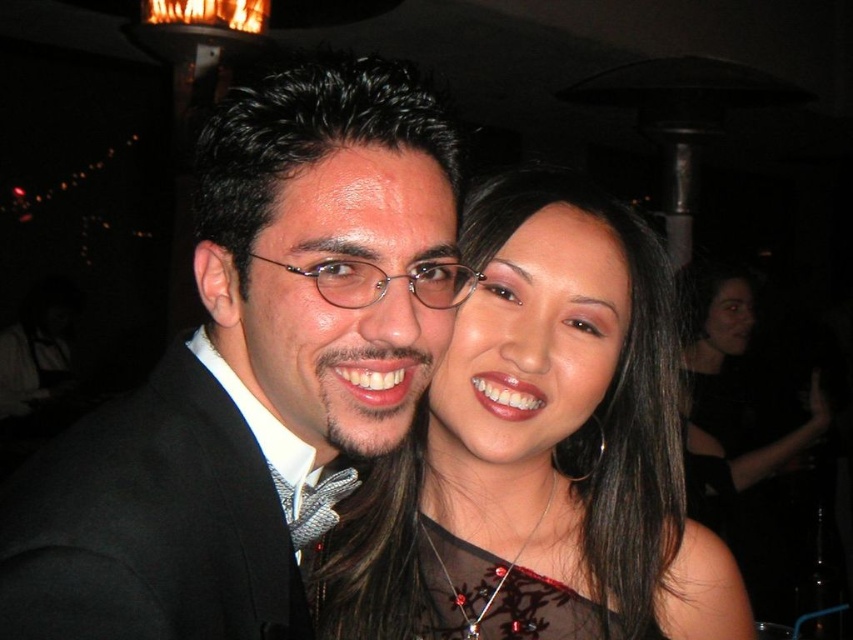
In the scene shown: Can you confirm if black wool suit at left is shorter than black satin dress at right?

Indeed, black wool suit at left has a lesser height compared to black satin dress at right.

Measure the distance from black wool suit at left to black satin dress at right.

black wool suit at left is 7.36 feet from black satin dress at right.

Between point (234, 536) and point (780, 592), which one is positioned in front?

Point (234, 536)

What are the coordinates of `black wool suit at left` in the screenshot? It's located at (152, 520).

Which is above, satin black dress at center or black satin dress at right?

satin black dress at center is higher up.

Which is more to the right, satin black dress at center or black satin dress at right?

black satin dress at right is more to the right.

Is point (451, 504) positioned after point (807, 429)?

No, it is in front of (807, 429).

Identify the location of satin black dress at center. (540, 451).

Does black satin suit at center have a lesser width compared to satin black dress at center?

Yes, black satin suit at center is thinner than satin black dress at center.

This screenshot has width=853, height=640. Identify the location of black satin suit at center. (254, 371).